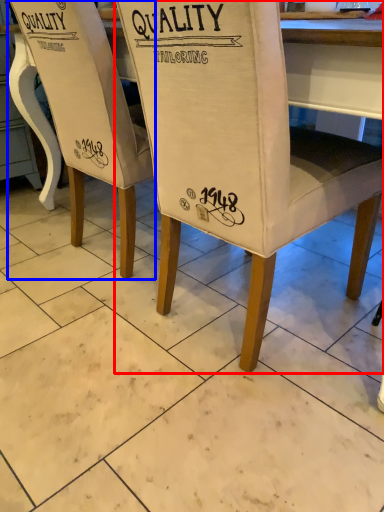
Question: Which point is closer to the camera, chair (highlighted by a red box) or chair (highlighted by a blue box)?

Choices:
 (A) chair
 (B) chair

Answer: (A)